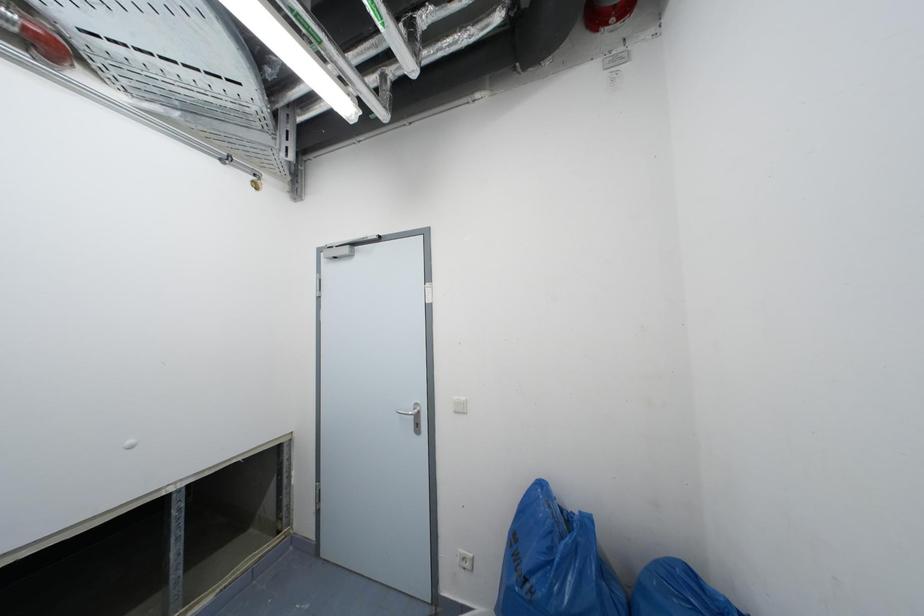
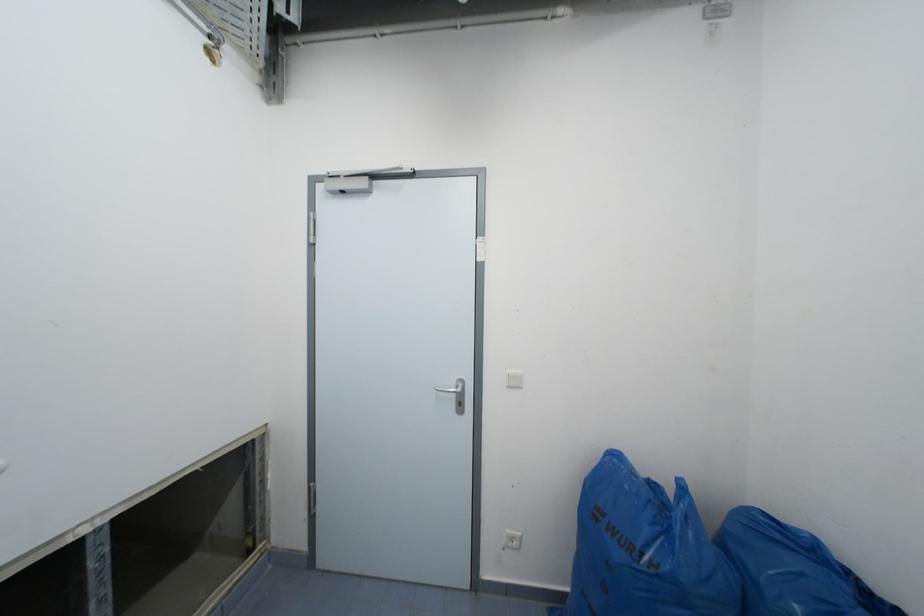
Question: The camera is either moving clockwise (left) or counter-clockwise (right) around the object. The first image is from the beginning of the video and the second image is from the end. Is the camera moving left or right when shooting the video?

Choices:
 (A) Left
 (B) Right

Answer: (A)